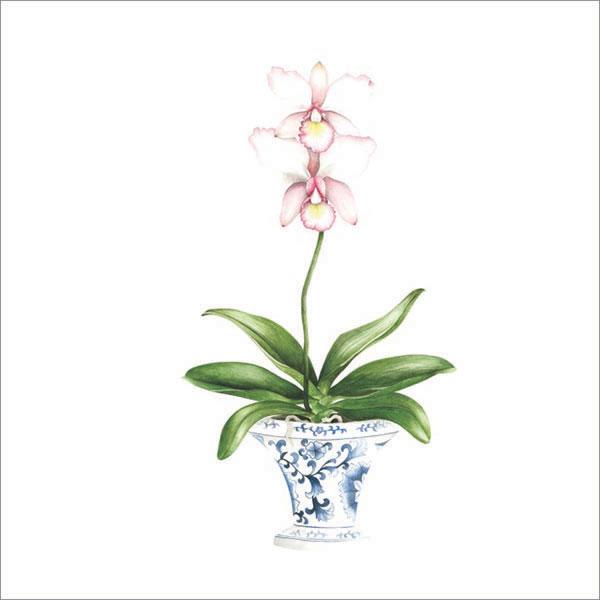
The width and height of the screenshot is (600, 600). I want to click on pot, so click(x=333, y=489).